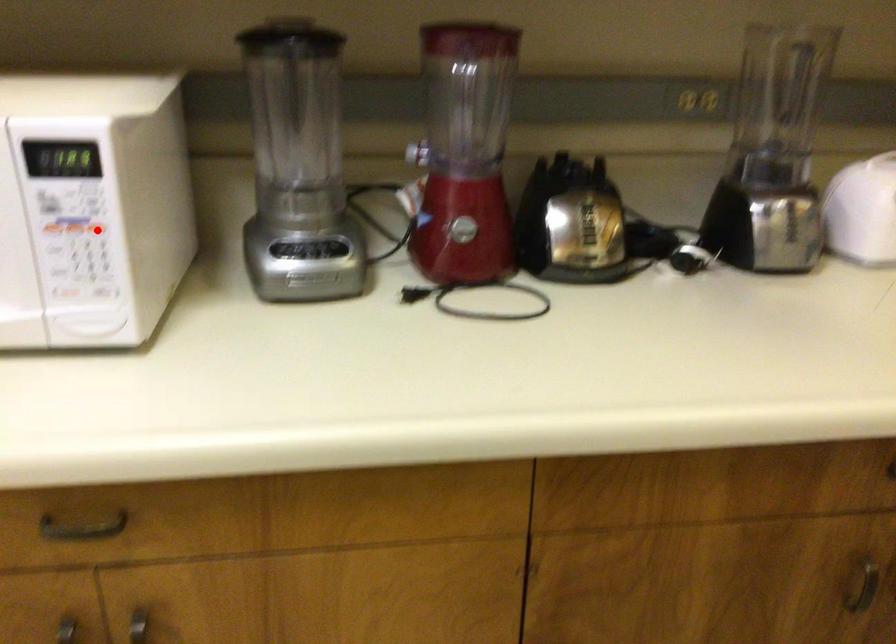
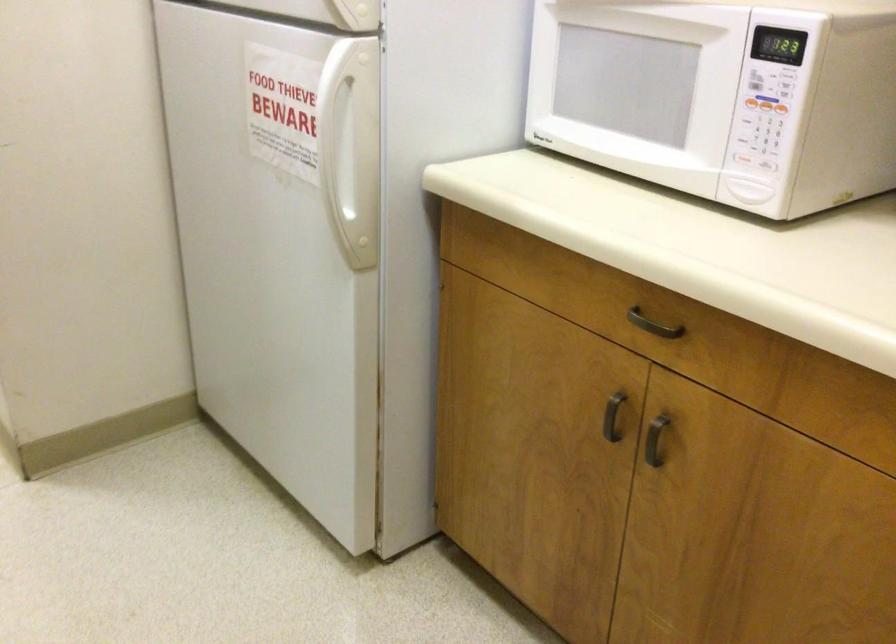
Question: A red point is marked in image1. In image2, is the corresponding 3D point closer to the camera or farther? Reply with the corresponding letter.

Choices:
 (A) The corresponding 3D point is closer.
 (B) The corresponding 3D point is farther.

Answer: (B)